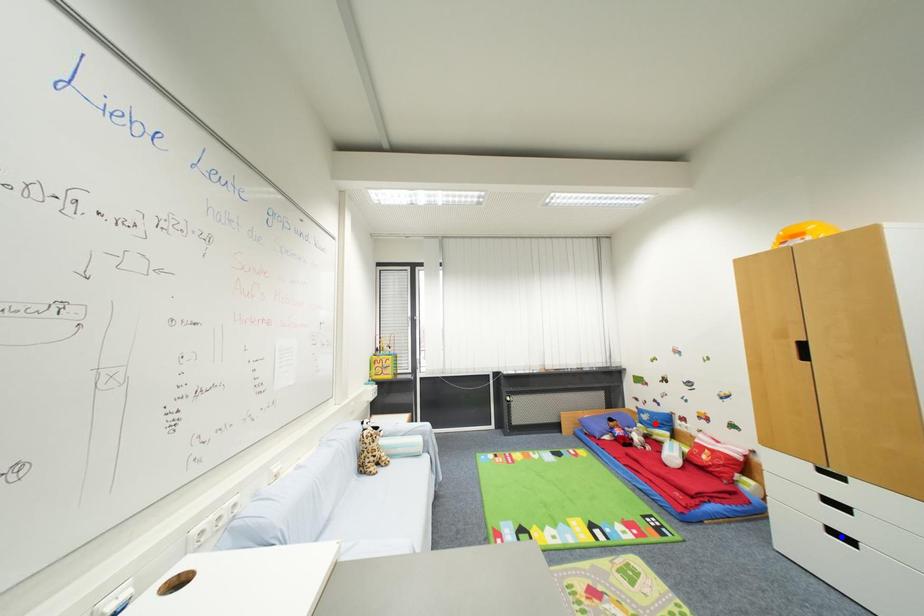
Question: Two points are marked on the image. Which point is closer to the camera?

Choices:
 (A) Blue point is closer.
 (B) Red point is closer.

Answer: (A)